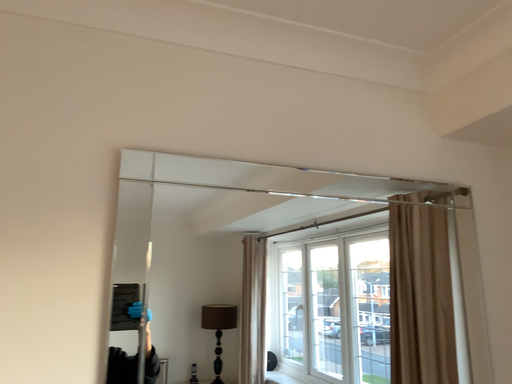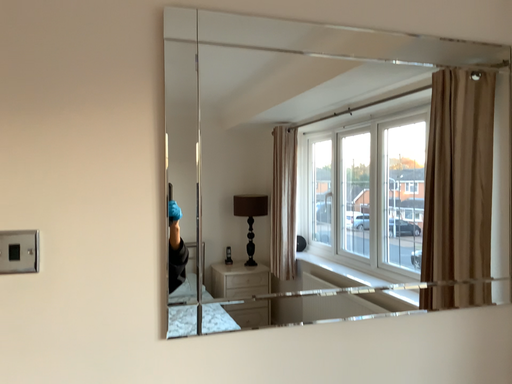
Question: How did the camera likely rotate when shooting the video?

Choices:
 (A) rotated upward
 (B) rotated downward

Answer: (B)